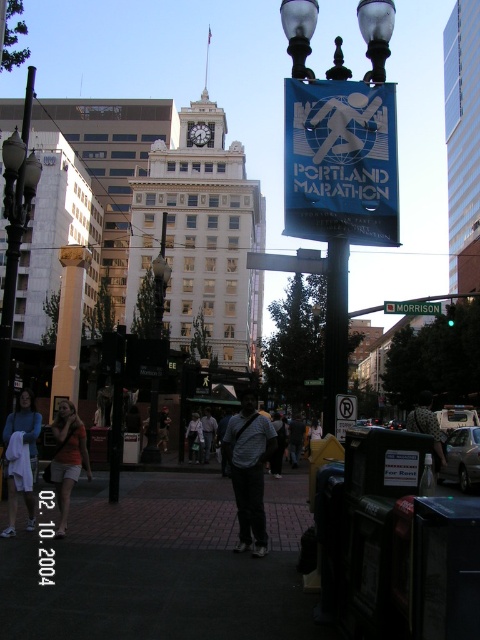
Is white glossy clock tower at center behind green metallic street sign at center?

Yes, white glossy clock tower at center is behind green metallic street sign at center.

Locate an element on the screen. The width and height of the screenshot is (480, 640). white glossy clock tower at center is located at coordinates (202, 237).

Does dark brick pavement at center have a greater width compared to metallic pole at center?

Indeed, dark brick pavement at center has a greater width compared to metallic pole at center.

Measure the distance between dark brick pavement at center and camera.

25.94 feet

Does point (49, 628) come behind point (367, 216)?

No, (49, 628) is closer to viewer.

The height and width of the screenshot is (640, 480). What are the coordinates of `dark brick pavement at center` in the screenshot? It's located at (162, 566).

How much distance is there between light blue denim jacket at lower left and patterned fabric shirt at center?

33.63 feet

Is light blue denim jacket at lower left positioned before patterned fabric shirt at center?

Yes, light blue denim jacket at lower left is closer to the viewer.

Describe the element at coordinates (22, 458) in the screenshot. I see `light blue denim jacket at lower left` at that location.

In order to click on light blue denim jacket at lower left in this screenshot , I will do `click(22, 458)`.